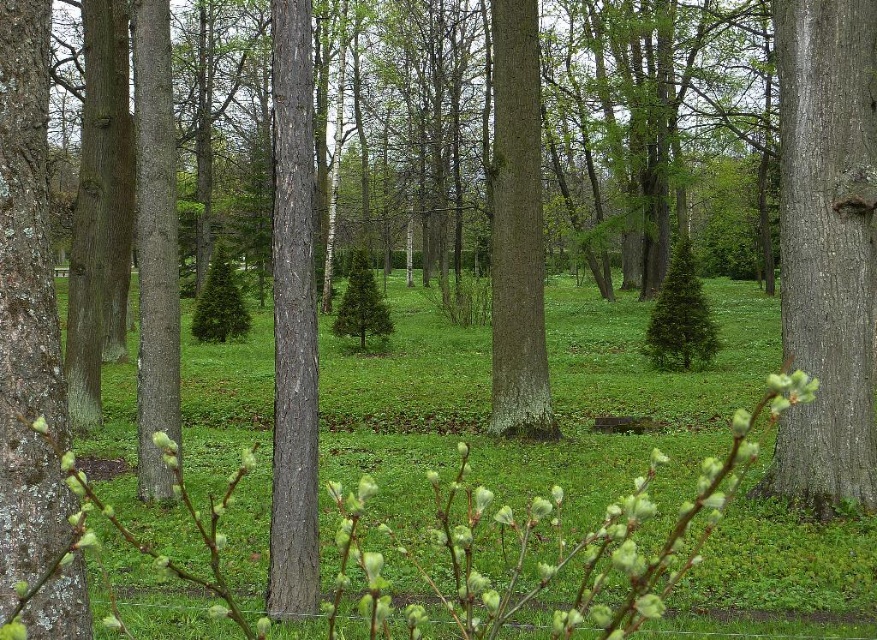
Question: Which of the following is the farthest from the observer?

Choices:
 (A) smooth bark tree trunk at right
 (B) lichen-covered bark tree trunk at left
 (C) smooth brown tree trunk at center

Answer: (A)

Question: Which of these objects is positioned farthest from the lichen-covered bark tree trunk at left?

Choices:
 (A) smooth bark tree trunk at center
 (B) green grassy at center
 (C) smooth brown tree trunk at center

Answer: (B)

Question: Does lichen-covered bark tree trunk at left have a lesser width compared to smooth brown tree trunk at center?

Choices:
 (A) yes
 (B) no

Answer: (A)

Question: Does green grassy at center have a larger size compared to smooth bark tree trunk at right?

Choices:
 (A) yes
 (B) no

Answer: (A)

Question: Which of these objects is positioned closest to the smooth bark tree trunk at right?

Choices:
 (A) green grassy at center
 (B) smooth bark tree trunk at center

Answer: (B)

Question: Does green grassy at center lie in front of smooth brown tree trunk at center?

Choices:
 (A) no
 (B) yes

Answer: (A)